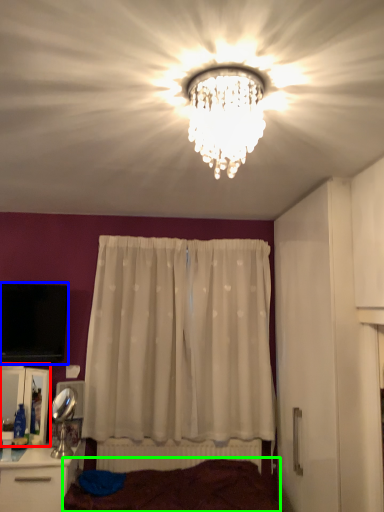
Question: Based on their relative distances, which object is nearer to cabinetry (highlighted by a red box)? Choose from television (highlighted by a blue box) and bed frame (highlighted by a green box).

Choices:
 (A) television
 (B) bed frame

Answer: (A)